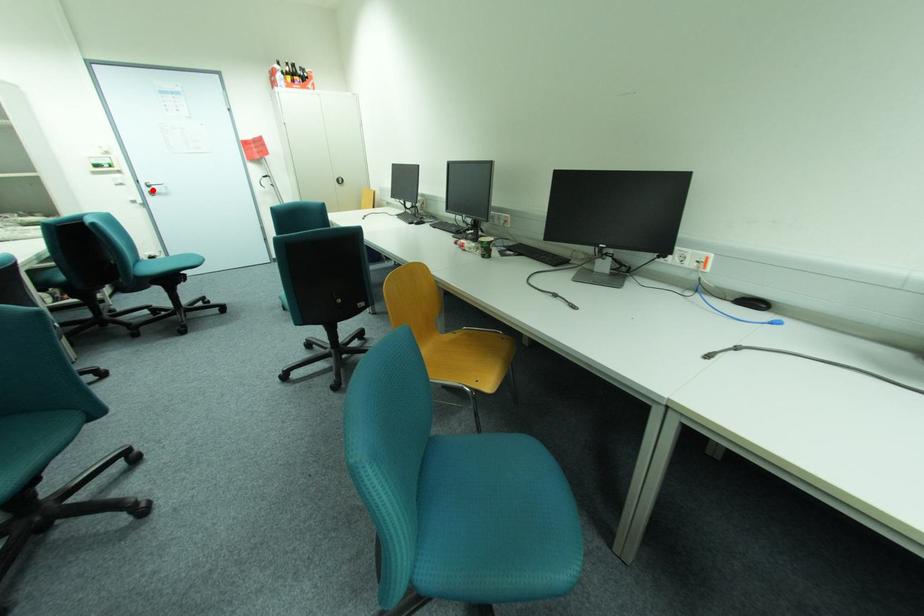
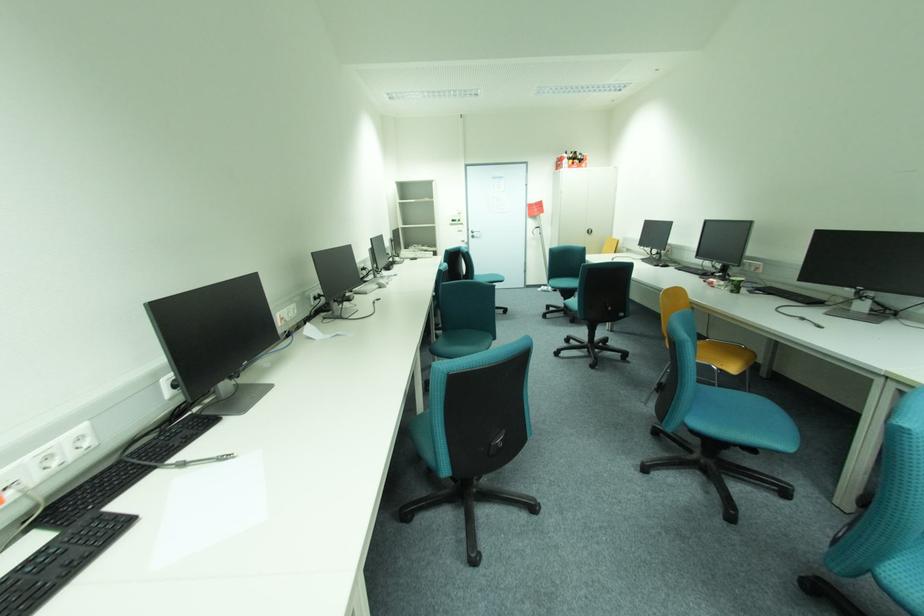
Question: I am providing you with two images of the same scene from different viewpoints. A red point is shown in image1. For the corresponding object point in image2, is it positioned nearer or farther from the camera?

Choices:
 (A) Nearer
 (B) Farther

Answer: (A)